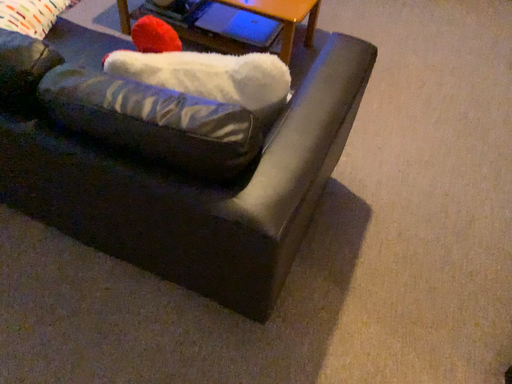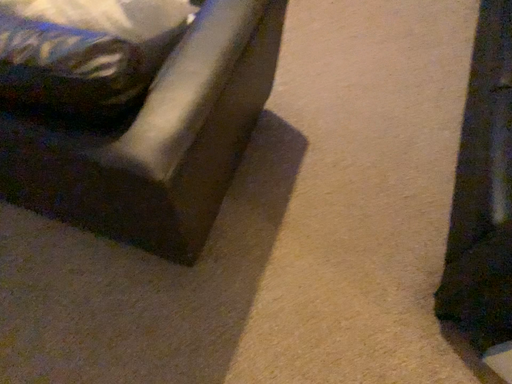
Question: Which way did the camera rotate in the video?

Choices:
 (A) rotated upward
 (B) rotated downward

Answer: (B)